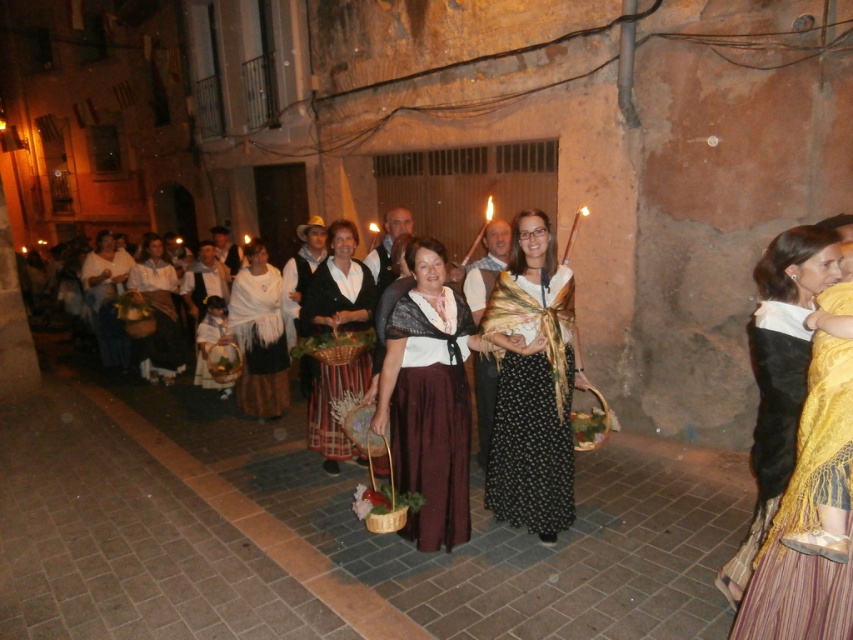
Does striped cotton skirt at center appear over white cotton dress at center?

Actually, striped cotton skirt at center is below white cotton dress at center.

Between striped cotton skirt at center and white cotton dress at center, which one appears on the left side from the viewer's perspective?

Positioned to the left is white cotton dress at center.

Image resolution: width=853 pixels, height=640 pixels. In order to click on striped cotton skirt at center in this screenshot , I will do `click(339, 288)`.

Does white cotton shawl at center have a lesser width compared to matte white blouse at center?

Yes.

Which is behind, point (256, 272) or point (157, 268)?

The point (157, 268) is behind.

This screenshot has width=853, height=640. I want to click on white cotton shawl at center, so click(259, 336).

How distant is matte brown skirt at center from matte white blouse at center?

A distance of 4.91 meters exists between matte brown skirt at center and matte white blouse at center.

Between point (421, 269) and point (151, 353), which one is positioned behind?

The point (151, 353) is more distant.

Is point (418, 428) positioned before point (149, 365)?

That is True.

What are the coordinates of `matte brown skirt at center` in the screenshot? It's located at (428, 397).